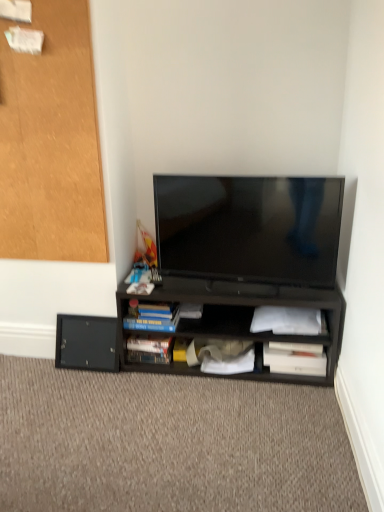
Question: Considering the relative positions of white matte paper at lower right, which is counted as the third paperback book, starting from the left, and hardcover book at lower center, which is counted as the first paperback book, starting from the left, in the image provided, is white matte paper at lower right, which is counted as the third paperback book, starting from the left, to the left or to the right of hardcover book at lower center, which is counted as the first paperback book, starting from the left,?

Choices:
 (A) left
 (B) right

Answer: (B)

Question: Does point (268, 309) appear closer or farther from the camera than point (140, 360)?

Choices:
 (A) farther
 (B) closer

Answer: (B)

Question: Which object is the closest to the white matte paper at lower right, the 2th paperback book positioned from the right?

Choices:
 (A) black matte cabinet at upper left
 (B) hardcover book at lower center, which is counted as the first paperback book, starting from the left
 (C) blue matte paperback book at center, which ranks as the 3th paperback book in right-to-left order
 (D) white paper at lower center
 (E) white paper at lower right, which is the first paperback book in right-to-left order

Answer: (E)

Question: Considering the real-world distances, which object is farthest from the hardcover book at lower center, which is counted as the first paperback book, starting from the left?

Choices:
 (A) blue matte paperback book at center, the second paperback book in the left-to-right sequence
 (B) black matte drawer at lower left
 (C) carpet at lower center
 (D) matte black tv at center
 (E) white paper at lower center

Answer: (D)